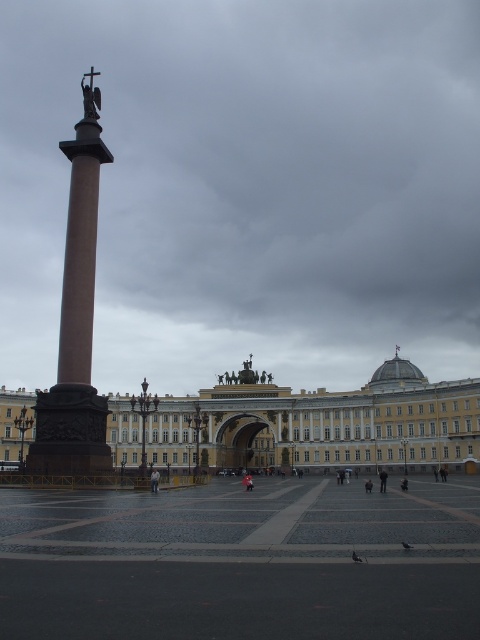
In the scene shown: Does brown polished column at left have a lesser width compared to bronze statue at center?

No, brown polished column at left is not thinner than bronze statue at center.

Describe the element at coordinates (75, 321) in the screenshot. I see `brown polished column at left` at that location.

Find the location of `brown polished column at left`. brown polished column at left is located at coordinates (75, 321).

Between point (478, 420) and point (364, 440), which one is positioned behind?

Point (364, 440)

Can you confirm if smooth stone plaza at center is bigger than golden ornate building at center?

Correct, smooth stone plaza at center is larger in size than golden ornate building at center.

Where is `smooth stone plaza at center`? Image resolution: width=480 pixels, height=640 pixels. smooth stone plaza at center is located at coordinates (263, 531).

Can you confirm if gray feathered pigeon at lower center is positioned above gray matte pigeon at lower right?

Yes.

Locate an element on the screen. gray feathered pigeon at lower center is located at coordinates (356, 556).